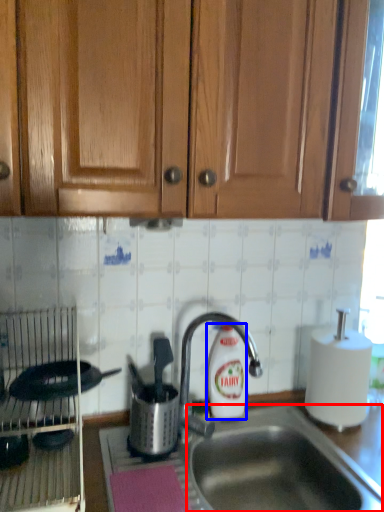
Question: Among these objects, which one is farthest to the camera, sink (highlighted by a red box) or cleaning product (highlighted by a blue box)?

Choices:
 (A) sink
 (B) cleaning product

Answer: (B)